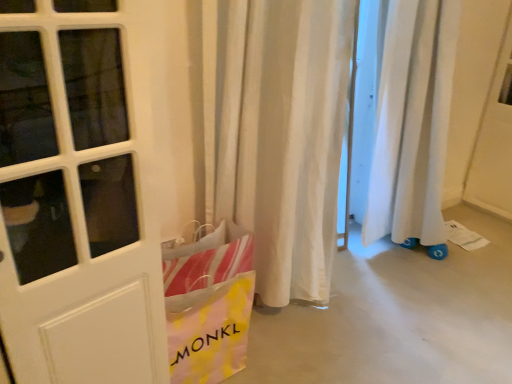
Question: Could you tell me if yellow and pink plastic bag at lower left is facing white fabric curtain at center?

Choices:
 (A) no
 (B) yes

Answer: (A)

Question: Is yellow and pink plastic bag at lower left bigger than white fabric curtain at center?

Choices:
 (A) no
 (B) yes

Answer: (A)

Question: Is yellow and pink plastic bag at lower left not near white fabric curtain at center?

Choices:
 (A) yes
 (B) no

Answer: (B)

Question: From the image's perspective, is yellow and pink plastic bag at lower left below white fabric curtain at center?

Choices:
 (A) no
 (B) yes

Answer: (B)

Question: Does yellow and pink plastic bag at lower left appear on the right side of white fabric curtain at center?

Choices:
 (A) yes
 (B) no

Answer: (B)

Question: Is yellow and pink plastic bag at lower left looking in the opposite direction of white fabric curtain at center?

Choices:
 (A) yes
 (B) no

Answer: (B)

Question: Considering the relative positions of white fabric curtain at center and yellow and pink plastic bag at lower left in the image provided, is white fabric curtain at center behind yellow and pink plastic bag at lower left?

Choices:
 (A) no
 (B) yes

Answer: (A)

Question: Is yellow and pink plastic bag at lower left at the back of white fabric curtain at center?

Choices:
 (A) yes
 (B) no

Answer: (B)

Question: Considering the relative sizes of white fabric curtain at center and yellow and pink plastic bag at lower left in the image provided, is white fabric curtain at center smaller than yellow and pink plastic bag at lower left?

Choices:
 (A) yes
 (B) no

Answer: (B)

Question: Can you confirm if white fabric curtain at center is taller than yellow and pink plastic bag at lower left?

Choices:
 (A) yes
 (B) no

Answer: (A)

Question: From the image's perspective, would you say white fabric curtain at center is shown under yellow and pink plastic bag at lower left?

Choices:
 (A) no
 (B) yes

Answer: (A)

Question: Is white fabric curtain at center at the right side of yellow and pink plastic bag at lower left?

Choices:
 (A) yes
 (B) no

Answer: (A)

Question: From a real-world perspective, is white fabric curtain at center above or below yellow and pink plastic bag at lower left?

Choices:
 (A) above
 (B) below

Answer: (A)